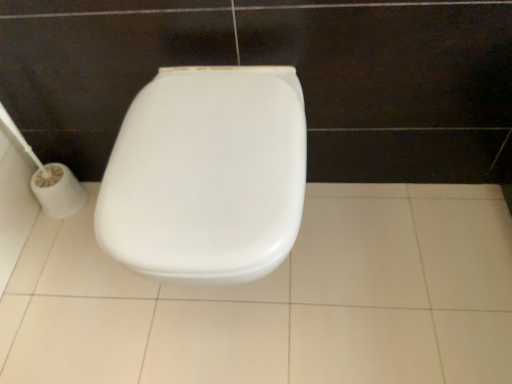
Describe the element at coordinates (207, 175) in the screenshot. I see `white plastic toilet at center` at that location.

You are a GUI agent. You are given a task and a screenshot of the screen. Output one action in this format:
    pyautogui.click(x=<x>, y=<y>)
    Task: Click on the white plastic toilet paper at left
    
    Given the screenshot: What is the action you would take?
    pyautogui.click(x=50, y=179)

Which is less distant, (57, 164) or (471, 381)?

Clearly, point (57, 164) is more distant from the camera than point (471, 381).

Is white plastic toilet paper at left positioned behind white glossy tile at center?

Yes, the depth of white plastic toilet paper at left is greater than that of white glossy tile at center.

Is white plastic toilet paper at left not within white glossy tile at center?

Absolutely, white plastic toilet paper at left is external to white glossy tile at center.

From the image's perspective, which object appears higher, white plastic toilet paper at left or white glossy tile at center?

white plastic toilet paper at left.

Would you consider white plastic toilet paper at left to be distant from white plastic toilet at center?

white plastic toilet paper at left is actually quite close to white plastic toilet at center.

Where is `toilet above the white plastic toilet paper at left (from a real-world perspective)`? Image resolution: width=512 pixels, height=384 pixels. toilet above the white plastic toilet paper at left (from a real-world perspective) is located at coordinates (207, 175).

Between point (51, 186) and point (205, 70), which one is positioned behind?

Positioned behind is point (51, 186).

Between white plastic toilet paper at left and white plastic toilet at center, which one is positioned in front?

white plastic toilet at center.

Is white glossy tile at center to the right of white plastic toilet at center from the viewer's perspective?

Correct, you'll find white glossy tile at center to the right of white plastic toilet at center.

Does point (230, 380) appear closer or farther from the camera than point (138, 120)?

Point (230, 380) is farther from the camera than point (138, 120).

Is white glossy tile at center further to camera compared to white plastic toilet at center?

Yes.

Can you confirm if white glossy tile at center is thinner than white plastic toilet at center?

No.

Can you confirm if white plastic toilet at center is shorter than white glossy tile at center?

No.

Measure the distance from white plastic toilet at center to white glossy tile at center.

17.68 inches.

Which object is more forward, white plastic toilet at center or white glossy tile at center?

white plastic toilet at center is closer to the camera.

Can you tell me how much white plastic toilet at center and white glossy tile at center differ in facing direction?

The angular difference between white plastic toilet at center and white glossy tile at center is 90.4 degrees.

Which object is positioned more to the right, white plastic toilet at center or white plastic toilet paper at left?

Positioned to the right is white plastic toilet at center.

From the picture: Is white plastic toilet at center facing away from white plastic toilet paper at left?

No, white plastic toilet at center is not facing away from white plastic toilet paper at left.

Looking at this image, from the image's perspective, between white plastic toilet at center and white plastic toilet paper at left, which one is located above?

white plastic toilet paper at left is shown above in the image.

Which is behind, point (221, 70) or point (6, 114)?

The point (6, 114) is more distant.

Considering their positions, is white glossy tile at center located in front of or behind white plastic toilet paper at left?

white glossy tile at center is positioned closer to the viewer than white plastic toilet paper at left.

Is point (312, 184) positioned before point (59, 170)?

No.

Which object is positioned more to the left, white glossy tile at center or white plastic toilet paper at left?

Positioned to the left is white plastic toilet paper at left.

Is white glossy tile at center surrounding white plastic toilet paper at left?

That's incorrect, white plastic toilet paper at left is not inside white glossy tile at center.

I want to click on toilet paper that appears behind the white glossy tile at center, so click(x=50, y=179).

Where is `toilet paper that is under the white plastic toilet at center (from a real-world perspective)`? This screenshot has height=384, width=512. toilet paper that is under the white plastic toilet at center (from a real-world perspective) is located at coordinates (50, 179).

Based on their spatial positions, is white plastic toilet at center or white glossy tile at center closer to white plastic toilet paper at left?

white glossy tile at center lies closer to white plastic toilet paper at left than the other object.

From the image, which object appears to be nearer to white glossy tile at center, white plastic toilet paper at left or white plastic toilet at center?

white plastic toilet at center.

Looking at the image, which one is located further to white plastic toilet at center, white plastic toilet paper at left or white glossy tile at center?

white plastic toilet paper at left lies further to white plastic toilet at center than the other object.

Looking at the image, which one is located further to white plastic toilet at center, white glossy tile at center or white plastic toilet paper at left?

Among the two, white plastic toilet paper at left is located further to white plastic toilet at center.

Which object lies further to the anchor point white plastic toilet paper at left, white glossy tile at center or white plastic toilet at center?

white plastic toilet at center is further to white plastic toilet paper at left.

Based on their spatial positions, is white plastic toilet at center or white plastic toilet paper at left closer to white glossy tile at center?

white plastic toilet at center.

Locate an element on the screen. This screenshot has height=384, width=512. toilet between white plastic toilet paper at left and white glossy tile at center in the horizontal direction is located at coordinates (207, 175).